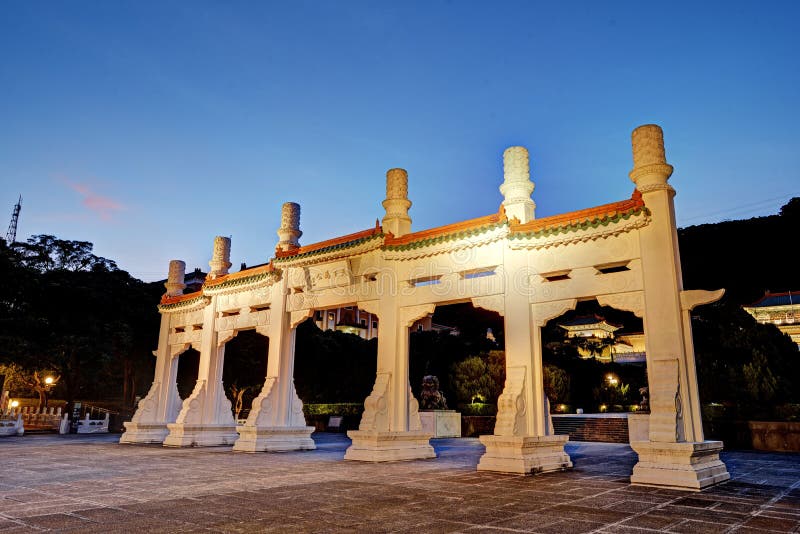
Where is `handrail`? This screenshot has width=800, height=534. handrail is located at coordinates (112, 409).